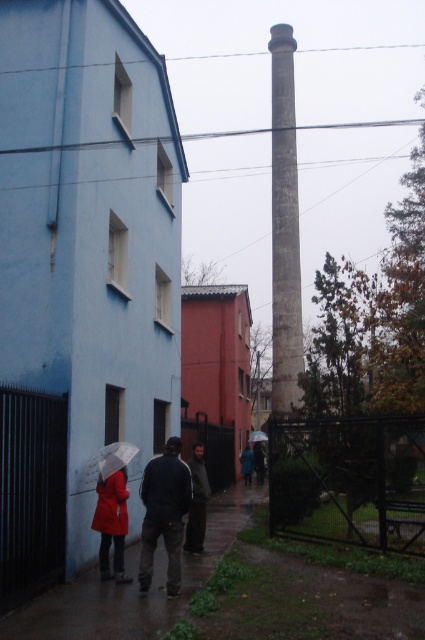
Question: Is matte red coat at center closer to the viewer compared to dark gray fabric jacket at center?

Choices:
 (A) no
 (B) yes

Answer: (B)

Question: In this image, where is matte red jacket at lower left located relative to transparent plastic umbrella at center?

Choices:
 (A) below
 (B) above

Answer: (B)

Question: Considering the real-world distances, which object is farthest from the matte red jacket at lower left?

Choices:
 (A) blue fabric jacket at center
 (B) dark gray fabric jacket at center
 (C) dark blue jeans at center
 (D) gray concrete chimney at center

Answer: (A)

Question: Can you confirm if dark gray jacket at center is thinner than blue fabric jacket at center?

Choices:
 (A) no
 (B) yes

Answer: (A)

Question: Which point is farther from the camera taking this photo?

Choices:
 (A) (147, 545)
 (B) (176, 534)
 (C) (280, 262)
 (D) (252, 458)

Answer: (D)

Question: Estimate the real-world distances between objects in this image. Which object is closer to the dark gray fabric jacket at center?

Choices:
 (A) dark blue jeans at center
 (B) transparent plastic umbrella at center

Answer: (A)